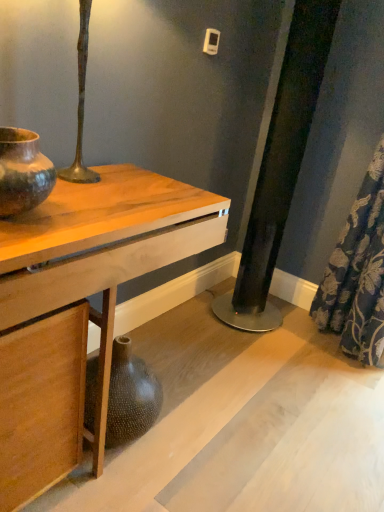
I want to click on matte brown ceramic vase at left, so click(x=23, y=172).

At what (x,y) coordinates should I click in order to perform the action: click on blue floral fabric at lower right. Please return your answer as a coordinate pair (x, y). Image resolution: width=384 pixels, height=512 pixels. Looking at the image, I should click on (357, 273).

Image resolution: width=384 pixels, height=512 pixels. Find the location of `matte brown ceramic vase at left`. matte brown ceramic vase at left is located at coordinates (23, 172).

From a real-world perspective, does blue floral fabric at lower right stand above matte brown ceramic vase at left?

No, from a real-world perspective, blue floral fabric at lower right is not over matte brown ceramic vase at left

How many degrees apart are the facing directions of blue floral fabric at lower right and matte brown ceramic vase at left?

The angle between the facing direction of blue floral fabric at lower right and the facing direction of matte brown ceramic vase at left is 92.1 degrees.

Does blue floral fabric at lower right have a lesser width compared to matte brown ceramic vase at left?

No.

Is blue floral fabric at lower right facing towards matte brown ceramic vase at left?

No, blue floral fabric at lower right is not facing towards matte brown ceramic vase at left.

Considering the relative sizes of matte brown ceramic vase at left and wooden table at center in the image provided, is matte brown ceramic vase at left thinner than wooden table at center?

Correct, the width of matte brown ceramic vase at left is less than that of wooden table at center.

Based on the photo, which object is further away from the camera taking this photo, matte brown ceramic vase at left or wooden table at center?

matte brown ceramic vase at left is further from the camera.

Considering the positions of points (22, 139) and (32, 390), is point (22, 139) farther from camera compared to point (32, 390)?

No, (22, 139) is in front of (32, 390).

Could you tell me if matte brown ceramic vase at left is turned towards wooden table at center?

No, matte brown ceramic vase at left is not aimed at wooden table at center.

Can you confirm if matte brown ceramic vase at left is smaller than blue floral fabric at lower right?

Yes.

From the image's perspective, which is below, matte brown ceramic vase at left or blue floral fabric at lower right?

matte brown ceramic vase at left, from the image's perspective.

Is matte brown ceramic vase at left taller or shorter than blue floral fabric at lower right?

matte brown ceramic vase at left is shorter than blue floral fabric at lower right.

Which is in front, point (14, 146) or point (376, 345)?

Positioned in front is point (14, 146).

Is blue floral fabric at lower right touching wooden table at center?

No, blue floral fabric at lower right is not next to wooden table at center.

Does blue floral fabric at lower right turn towards wooden table at center?

No, blue floral fabric at lower right is not oriented towards wooden table at center.

Considering the relative sizes of blue floral fabric at lower right and wooden table at center in the image provided, is blue floral fabric at lower right bigger than wooden table at center?

No, blue floral fabric at lower right is not bigger than wooden table at center.

Which is more to the left, blue floral fabric at lower right or wooden table at center?

From the viewer's perspective, wooden table at center appears more on the left side.

Which is correct: wooden table at center is inside matte brown ceramic vase at left, or outside of it?

wooden table at center is spatially situated outside matte brown ceramic vase at left.

Does wooden table at center appear on the left side of matte brown ceramic vase at left?

In fact, wooden table at center is to the right of matte brown ceramic vase at left.

Which is in front, point (43, 426) or point (24, 158)?

The point (24, 158) is in front.

From the image's perspective, between wooden table at center and matte brown ceramic vase at left, who is located below?

wooden table at center is shown below in the image.

From the picture: Between wooden table at center and blue floral fabric at lower right, which one has more height?

blue floral fabric at lower right.

You are a GUI agent. You are given a task and a screenshot of the screen. Output one action in this format:
    pyautogui.click(x=<x>, y=<y>)
    Task: Click on the shower curtain that is on the right side of wooden table at center
    The height and width of the screenshot is (512, 384).
    Given the screenshot: What is the action you would take?
    pyautogui.click(x=357, y=273)

Can you confirm if wooden table at center is bigger than blue floral fabric at lower right?

Indeed, wooden table at center has a larger size compared to blue floral fabric at lower right.

There is a blue floral fabric at lower right. Where is `vase above it (from a real-world perspective)`? The width and height of the screenshot is (384, 512). vase above it (from a real-world perspective) is located at coordinates (23, 172).

The image size is (384, 512). I want to click on table that is on the right side of matte brown ceramic vase at left, so click(x=79, y=307).

Looking at the image, which one is located further to matte brown ceramic vase at left, blue floral fabric at lower right or wooden table at center?

Among the two, blue floral fabric at lower right is located further to matte brown ceramic vase at left.

Looking at the image, which one is located closer to blue floral fabric at lower right, wooden table at center or matte brown ceramic vase at left?

Based on the image, wooden table at center appears to be nearer to blue floral fabric at lower right.

Looking at this image, when comparing their distances from wooden table at center, does blue floral fabric at lower right or matte brown ceramic vase at left seem further?

blue floral fabric at lower right.

From the image, which object appears to be nearer to matte brown ceramic vase at left, wooden table at center or blue floral fabric at lower right?

The object closer to matte brown ceramic vase at left is wooden table at center.

Looking at the image, which one is located closer to wooden table at center, matte brown ceramic vase at left or blue floral fabric at lower right?

matte brown ceramic vase at left is positioned closer to the anchor wooden table at center.

Which object lies nearer to the anchor point blue floral fabric at lower right, matte brown ceramic vase at left or wooden table at center?

Among the two, wooden table at center is located nearer to blue floral fabric at lower right.

Locate an element on the screen. Image resolution: width=384 pixels, height=512 pixels. table situated between matte brown ceramic vase at left and blue floral fabric at lower right from left to right is located at coordinates (79, 307).